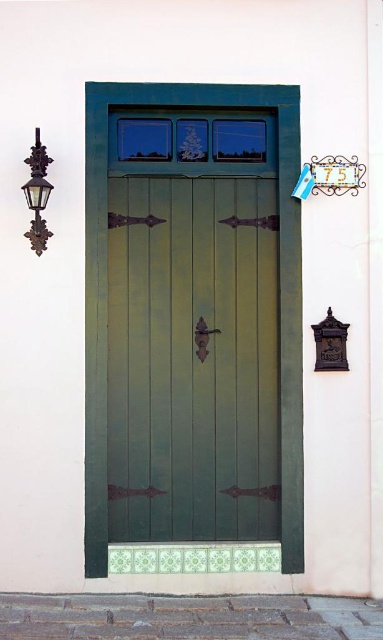
Question: Can you confirm if green painted wood door at center is wider than matte black lantern at left?

Choices:
 (A) no
 (B) yes

Answer: (B)

Question: Can you confirm if green painted wood door at center is positioned to the left of matte black lantern at left?

Choices:
 (A) yes
 (B) no

Answer: (B)

Question: Is green painted wood door at center closer to camera compared to matte black lantern at left?

Choices:
 (A) no
 (B) yes

Answer: (A)

Question: Which object is farther from the camera taking this photo?

Choices:
 (A) matte black lantern at left
 (B) green painted wood door at center

Answer: (B)

Question: Which of the following is the closest to the observer?

Choices:
 (A) matte black lantern at left
 (B) green painted wood door at center

Answer: (A)